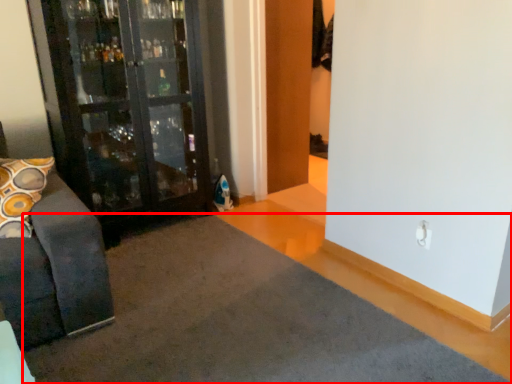
Question: Observing the image, what is the correct spatial positioning of doormat (annotated by the red box) in reference to door?

Choices:
 (A) right
 (B) left

Answer: (B)